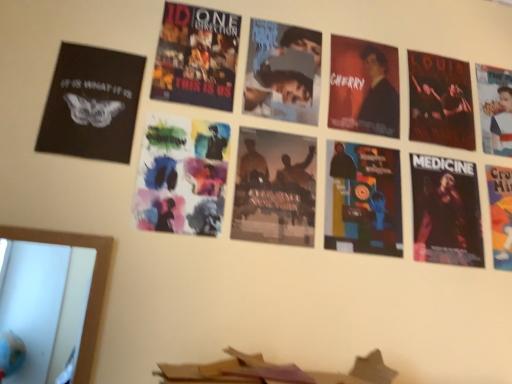
Question: From the image's perspective, is matte black poster at center, the 4th poster when ordered from right to left, below black matte poster at upper left, which is the first poster from left to right?

Choices:
 (A) yes
 (B) no

Answer: (A)

Question: Is matte black poster at center, the 4th poster when ordered from right to left, shorter than black matte poster at upper left, which is the first poster from left to right?

Choices:
 (A) no
 (B) yes

Answer: (A)

Question: Is the depth of matte black poster at center, the 4th poster when ordered from right to left, less than that of black matte poster at upper left, which is the first poster from left to right?

Choices:
 (A) no
 (B) yes

Answer: (A)

Question: Is matte black poster at center, the 4th poster when ordered from right to left, positioned behind black matte poster at upper left, arranged as the 7th poster when viewed from the right?

Choices:
 (A) yes
 (B) no

Answer: (A)

Question: Is matte black poster at center, the 4th poster when ordered from right to left, far away from black matte poster at upper left, which is the first poster from left to right?

Choices:
 (A) yes
 (B) no

Answer: (B)

Question: Looking at their shapes, would you say black glossy poster at right, acting as the 3th poster starting from the right, is wider or thinner than matte black poster at center, the 4th poster when ordered from right to left?

Choices:
 (A) thin
 (B) wide

Answer: (B)

Question: Is black glossy poster at right, placed as the 5th poster when sorted from left to right, inside or outside of matte black poster at center, the 4th poster when ordered from right to left?

Choices:
 (A) outside
 (B) inside

Answer: (A)

Question: Considering the positions of point (477, 231) and point (343, 211), is point (477, 231) closer or farther from the camera than point (343, 211)?

Choices:
 (A) farther
 (B) closer

Answer: (A)

Question: Is black glossy poster at right, acting as the 3th poster starting from the right, bigger or smaller than matte black poster at center, the 4th poster when ordered from right to left?

Choices:
 (A) big
 (B) small

Answer: (B)

Question: Relative to black matte poster at upper left, which is the first poster from left to right, is matte black poster at center, acting as the 4th poster starting from the left, in front or behind?

Choices:
 (A) behind
 (B) front

Answer: (A)

Question: Is point (389, 248) closer or farther from the camera than point (105, 61)?

Choices:
 (A) farther
 (B) closer

Answer: (A)

Question: From the image's perspective, relative to black matte poster at upper left, arranged as the 7th poster when viewed from the right, is matte black poster at center, the 4th poster when ordered from right to left, above or below?

Choices:
 (A) above
 (B) below

Answer: (B)

Question: In terms of width, does matte black poster at center, the 4th poster when ordered from right to left, look wider or thinner when compared to black matte poster at upper left, arranged as the 7th poster when viewed from the right?

Choices:
 (A) thin
 (B) wide

Answer: (A)

Question: From a real-world perspective, is matte black poster at center, acting as the 4th poster starting from the left, positioned above or below matte black suit at upper right?

Choices:
 (A) below
 (B) above

Answer: (A)

Question: From their relative heights in the image, would you say matte black poster at center, the 4th poster when ordered from right to left, is taller or shorter than matte black suit at upper right?

Choices:
 (A) tall
 (B) short

Answer: (A)